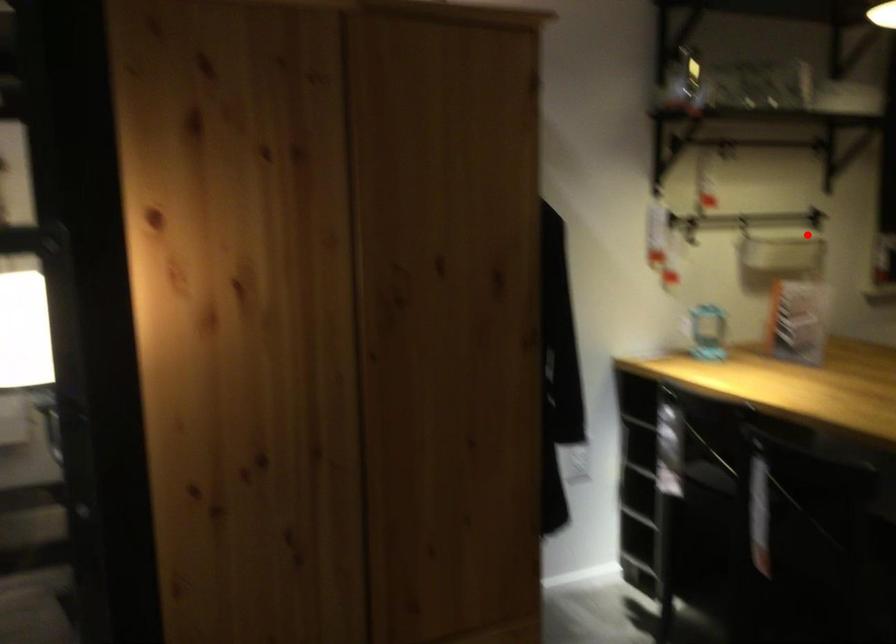
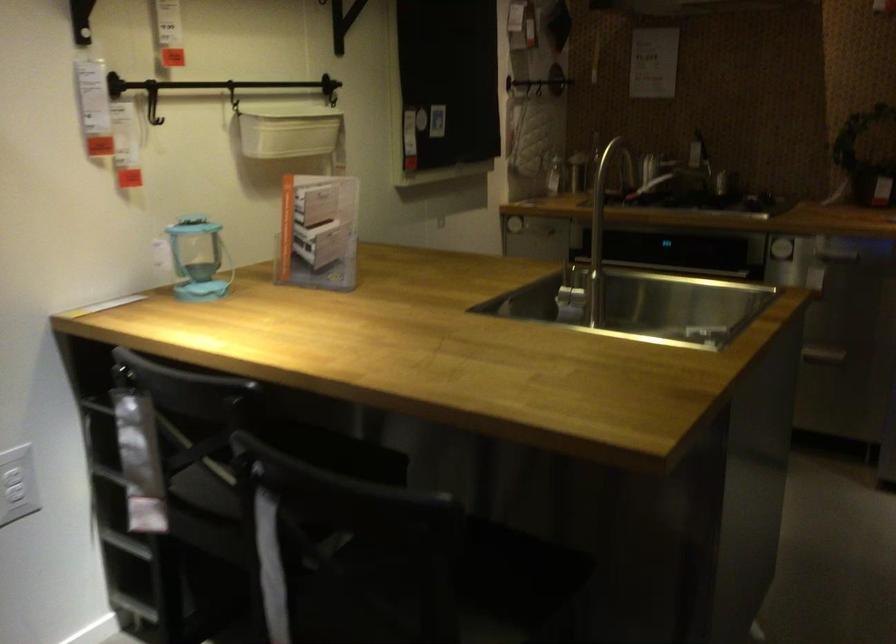
The point at the highlighted location is marked in the first image. Where is the corresponding point in the second image?

(287, 129)